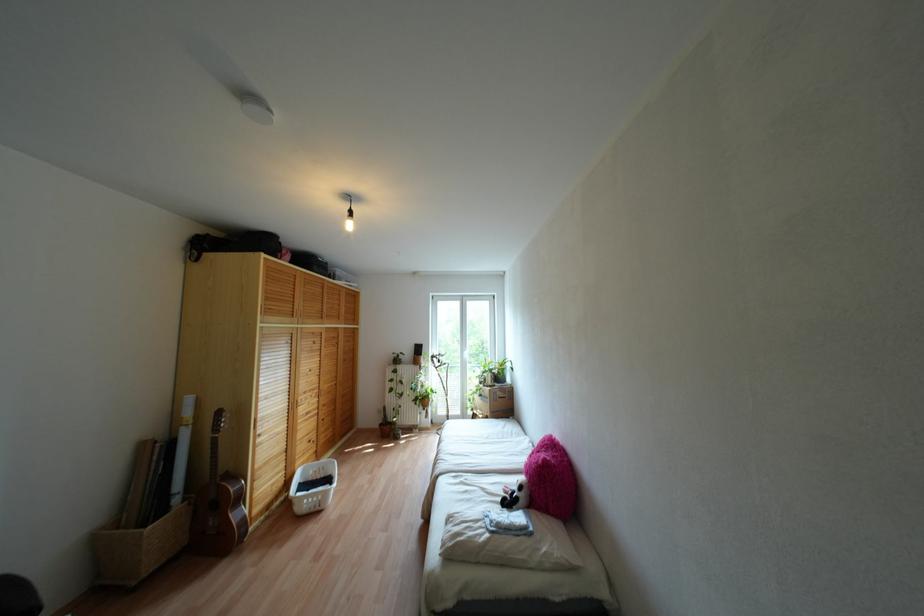
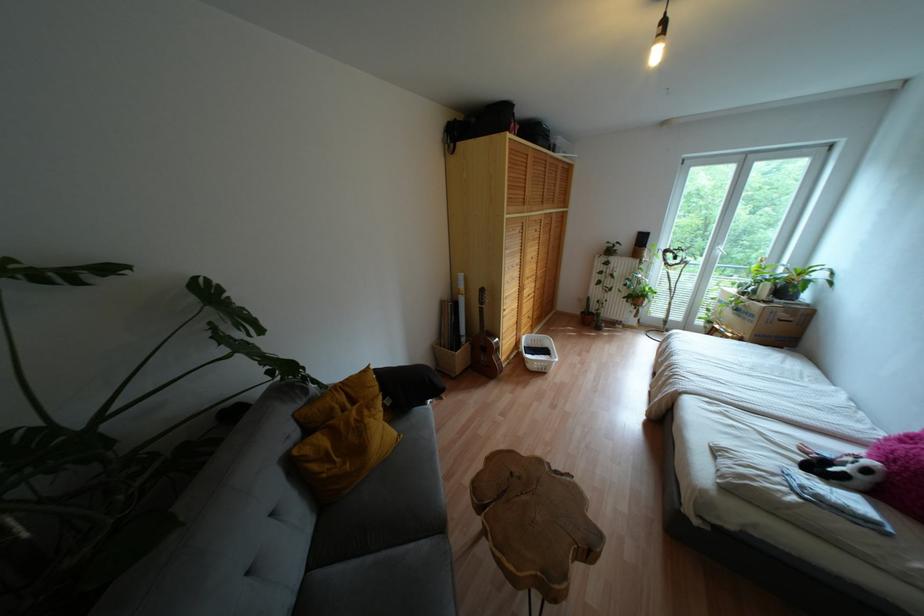
How did the camera likely rotate?

The camera's rotation is toward left-down.